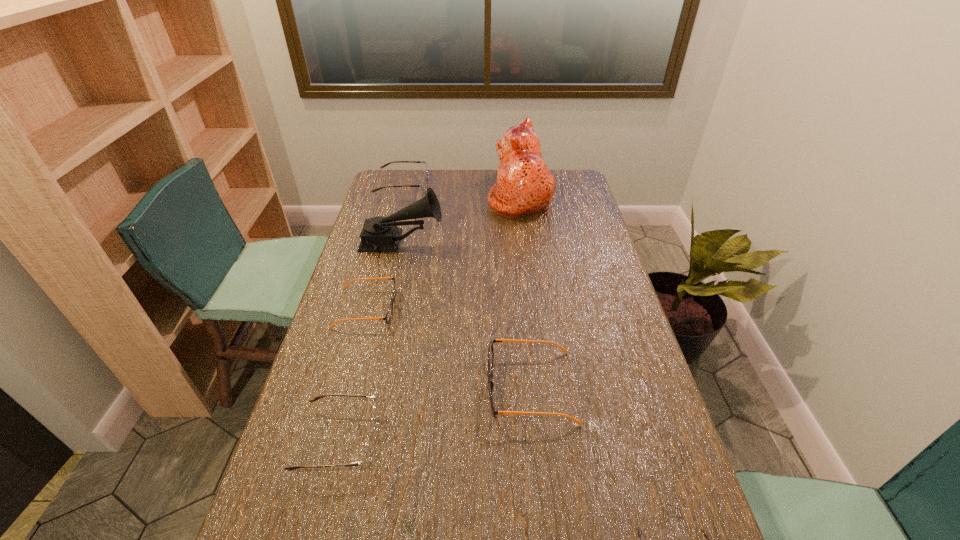
Identify the location of the tallest object. (524, 185).

What are the coordinates of `phonograph_record` in the screenshot? It's located at [379, 234].

Identify the location of black phonograph_record. The height and width of the screenshot is (540, 960). (379, 234).

Locate an element on the screen. the biggest brown spectacles is located at coordinates (423, 185).

The image size is (960, 540). I want to click on the farthest brown spectacles, so click(x=423, y=185).

What are the coordinates of `the nearer black spectacles` in the screenshot? It's located at (490, 350).

This screenshot has width=960, height=540. What are the coordinates of `the second spectacles from right to left` in the screenshot? It's located at (490, 350).

Identify the location of the second smallest brown spectacles. The width and height of the screenshot is (960, 540). (366, 459).

Locate an element on the screen. the second farthest spectacles is located at coordinates (388, 315).

At what (x,y) coordinates should I click in order to perform the action: click on the fourth farthest object. Please return your answer as a coordinate pair (x, y). The width and height of the screenshot is (960, 540). Looking at the image, I should click on (388, 315).